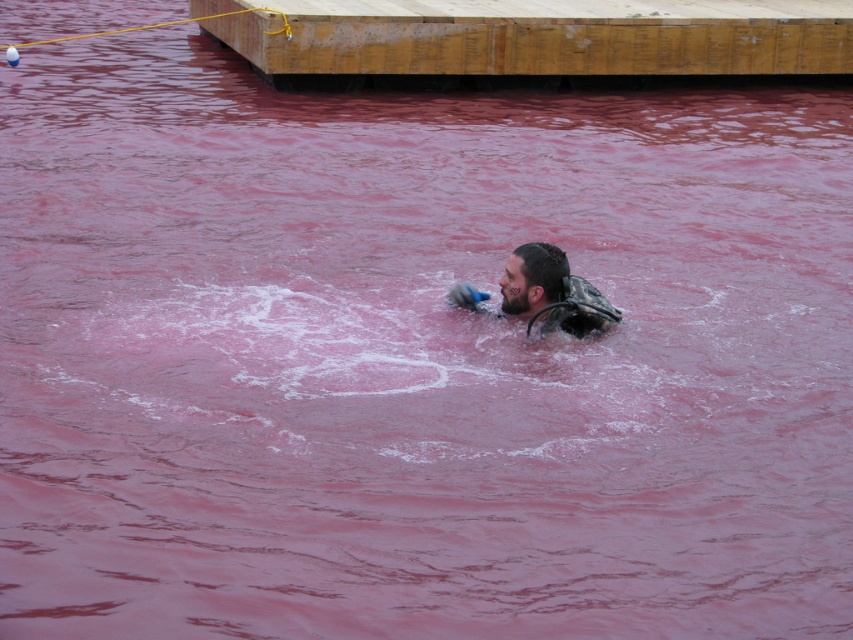
Question: Does wooden dock at upper center appear on the left side of camouflage fabric life jacket at center?

Choices:
 (A) no
 (B) yes

Answer: (B)

Question: Can you confirm if wooden dock at upper center is positioned above camouflage fabric at center?

Choices:
 (A) no
 (B) yes

Answer: (B)

Question: Among these objects, which one is farthest from the camera?

Choices:
 (A) camouflage fabric life jacket at center
 (B) wooden dock at upper center
 (C) camouflage fabric at center

Answer: (B)

Question: Can you confirm if wooden dock at upper center is positioned to the right of camouflage fabric life jacket at center?

Choices:
 (A) no
 (B) yes

Answer: (A)

Question: Which of the following is the closest to the observer?

Choices:
 (A) (521, 256)
 (B) (746, 12)

Answer: (A)

Question: Among these objects, which one is farthest from the camera?

Choices:
 (A) camouflage fabric at center
 (B) camouflage fabric life jacket at center

Answer: (B)